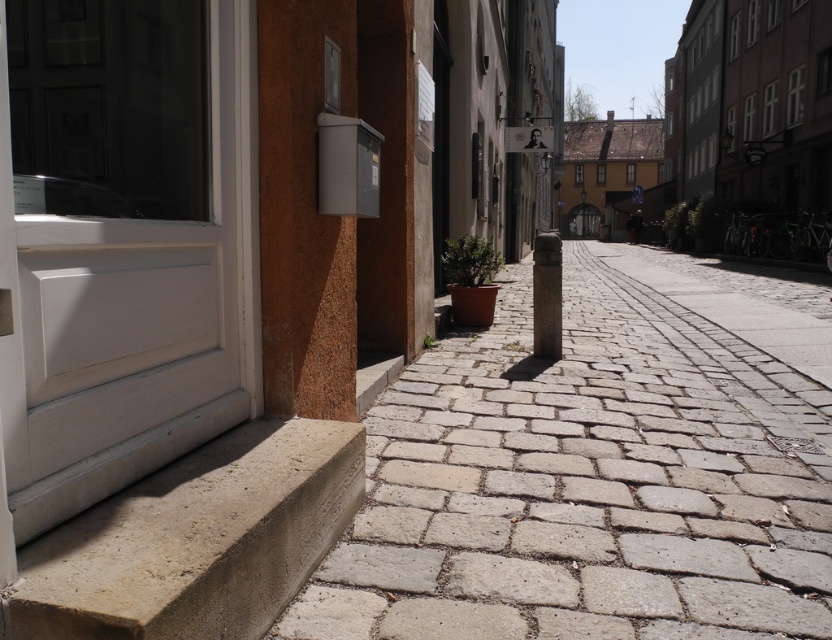
Is gray stone pavement at lower center wider than concrete step at lower left?

Yes.

Is point (815, 468) behind point (238, 506)?

Yes, point (815, 468) is farther from viewer.

Between point (365, 588) and point (330, 499), which one is positioned behind?

Positioned behind is point (330, 499).

Find the location of a particular element. The width and height of the screenshot is (832, 640). gray stone pavement at lower center is located at coordinates (587, 483).

Does gray stone pavement at lower center come behind smooth stone pillar at center?

That is False.

Is gray stone pavement at lower center below smooth stone pillar at center?

Yes.

Is point (320, 604) positioned in front of point (538, 253)?

Yes, point (320, 604) is in front of point (538, 253).

Identify the location of gray stone pavement at lower center. click(x=587, y=483).

Can you confirm if concrete step at lower left is positioned to the left of smooth stone pillar at center?

Correct, you'll find concrete step at lower left to the left of smooth stone pillar at center.

Who is positioned more to the right, concrete step at lower left or smooth stone pillar at center?

Positioned to the right is smooth stone pillar at center.

Is point (263, 426) less distant than point (560, 336)?

Yes, point (263, 426) is in front of point (560, 336).

I want to click on concrete step at lower left, so click(x=196, y=540).